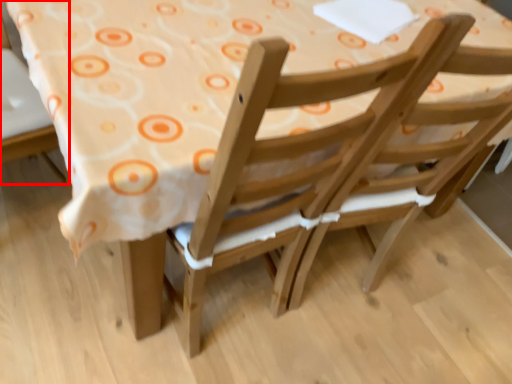
Question: In this image, where is chair (annotated by the red box) located relative to chair?

Choices:
 (A) left
 (B) right

Answer: (A)